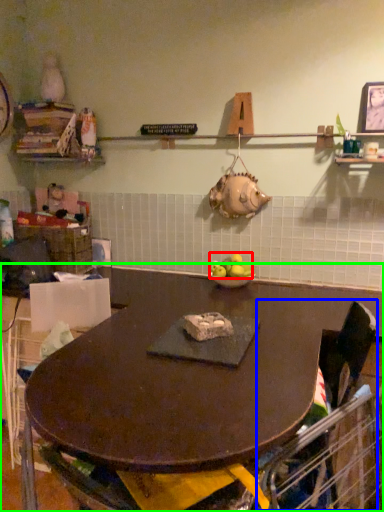
Question: Which object is positioned closest to apple (highlighted by a red box)? Select from swivel chair (highlighted by a blue box) and table (highlighted by a green box).

Choices:
 (A) swivel chair
 (B) table

Answer: (B)